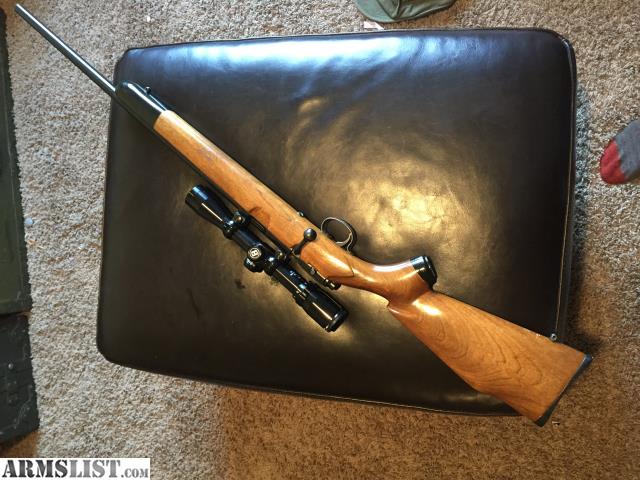
You are a GUI agent. You are given a task and a screenshot of the screen. Output one action in this format:
    pyautogui.click(x=<x>, y=<y>)
    Task: Click on the sock on right foot
    Image resolution: width=640 pixels, height=480 pixels.
    Given the screenshot: What is the action you would take?
    pyautogui.click(x=624, y=144)